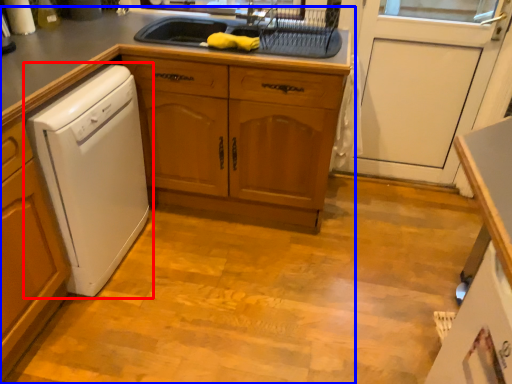
Question: Which point is further to the camera, home appliance (highlighted by a red box) or countertop (highlighted by a blue box)?

Choices:
 (A) home appliance
 (B) countertop

Answer: (B)